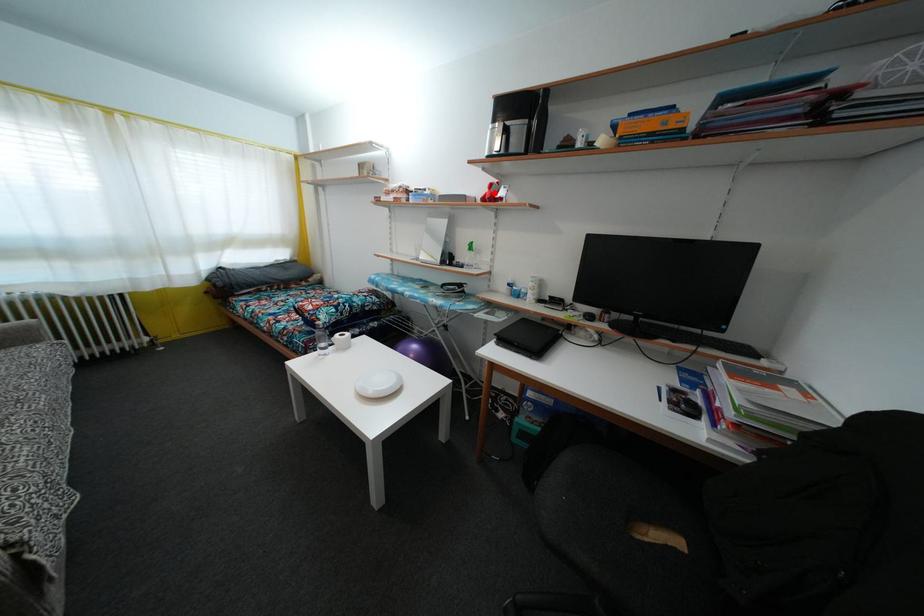
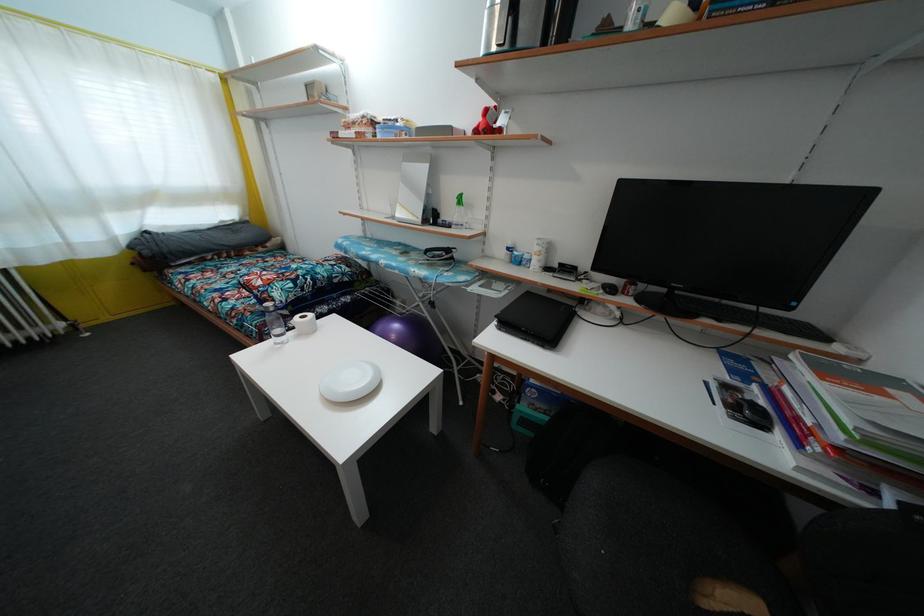
Find the pixel in the second image that matches the highlighted location in the first image.

(490, 119)